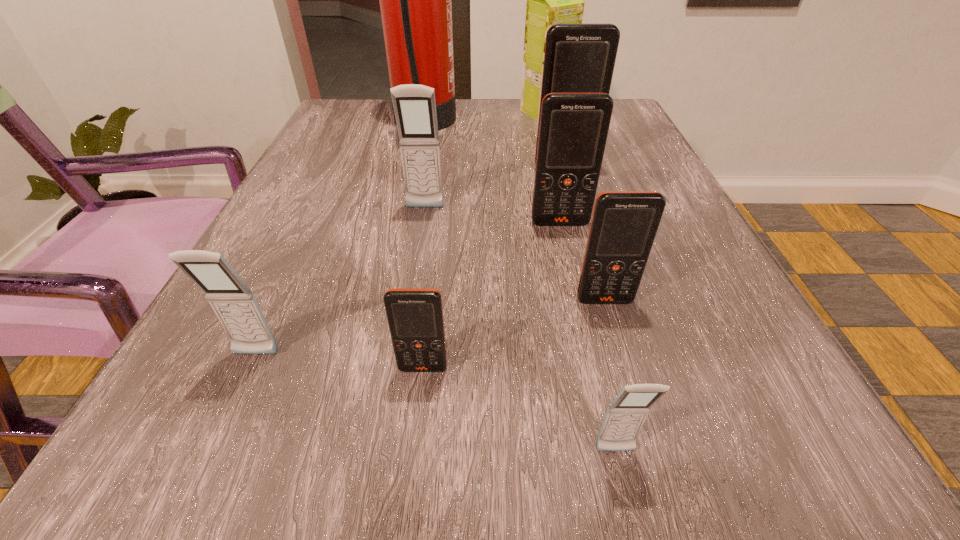
You are a GUI agent. You are given a task and a screenshot of the screen. Output one action in this format:
    pyautogui.click(x=<x>, y=<y>)
    Task: Click on the fire extinguisher
    
    Given the screenshot: What is the action you would take?
    pyautogui.click(x=415, y=0)

This screenshot has width=960, height=540. Identify the location of the tallest object. (415, 0).

The height and width of the screenshot is (540, 960). I want to click on soya milk, so click(x=551, y=0).

The height and width of the screenshot is (540, 960). Find the location of `the farthest cellular telephone`. the farthest cellular telephone is located at coordinates (579, 58).

Identify the location of the tallest cellular telephone. The width and height of the screenshot is (960, 540). (579, 58).

The image size is (960, 540). Identify the location of the biggest gray cellular telephone. (414, 105).

This screenshot has width=960, height=540. Identify the location of the farthest gray cellular telephone. (414, 105).

The width and height of the screenshot is (960, 540). I want to click on the third smallest orange cellular telephone, so click(573, 131).

The height and width of the screenshot is (540, 960). I want to click on the fifth farthest object, so click(x=573, y=131).

The image size is (960, 540). In order to click on the leftmost cellular telephone in this screenshot , I will do `click(236, 307)`.